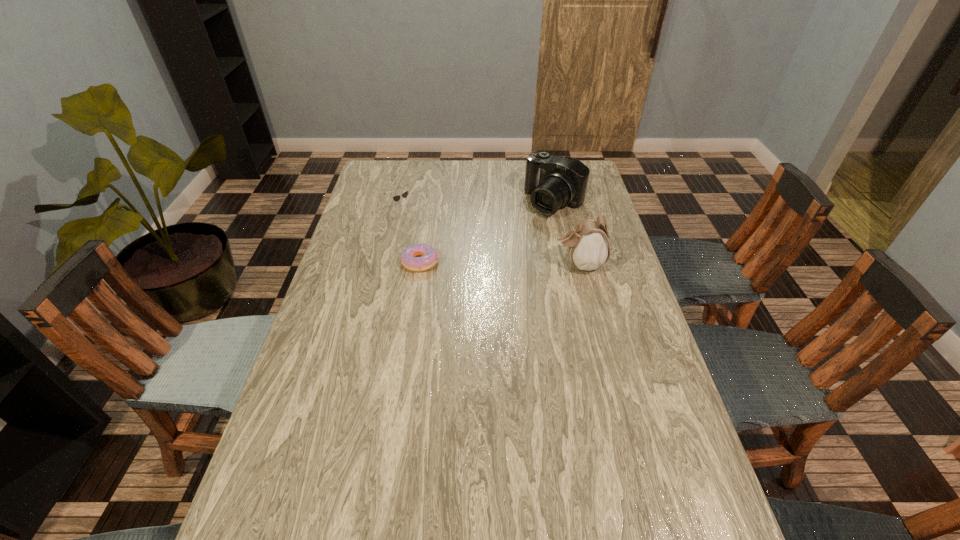
The image size is (960, 540). I want to click on free region located on the lens of the camera, so click(x=496, y=258).

I want to click on free space located 0.260m in front of the lenses of the sunglasses, so click(459, 250).

Find the location of a particular element. This screenshot has width=960, height=540. vacant region located 0.330m in front of the lenses of the sunglasses is located at coordinates (473, 260).

Locate an element on the screen. The width and height of the screenshot is (960, 540). vacant space situated in front of the lenses of the sunglasses is located at coordinates (421, 222).

The image size is (960, 540). In order to click on object at the far edge in this screenshot , I will do `click(554, 182)`.

Identify the location of object positioned at the left edge. (396, 198).

Image resolution: width=960 pixels, height=540 pixels. Find the location of `pouch situated at the right edge`. pouch situated at the right edge is located at coordinates (588, 244).

This screenshot has width=960, height=540. In order to click on camera at the right edge in this screenshot , I will do `click(554, 182)`.

This screenshot has width=960, height=540. Find the location of `object that is positioned at the far right corner`. object that is positioned at the far right corner is located at coordinates (554, 182).

Where is `vacant space at the far edge of the desktop`? This screenshot has width=960, height=540. vacant space at the far edge of the desktop is located at coordinates (447, 186).